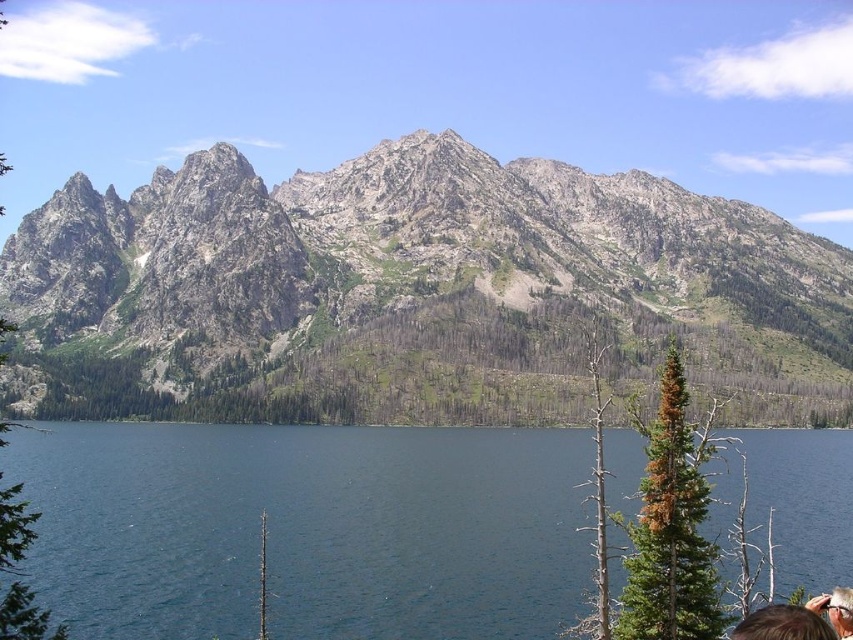
Between rocky gray mountain at upper center and deep blue water at center, which one is positioned higher?

rocky gray mountain at upper center

Can you confirm if rocky gray mountain at upper center is smaller than deep blue water at center?

Actually, rocky gray mountain at upper center might be larger than deep blue water at center.

The image size is (853, 640). I want to click on rocky gray mountain at upper center, so click(x=410, y=292).